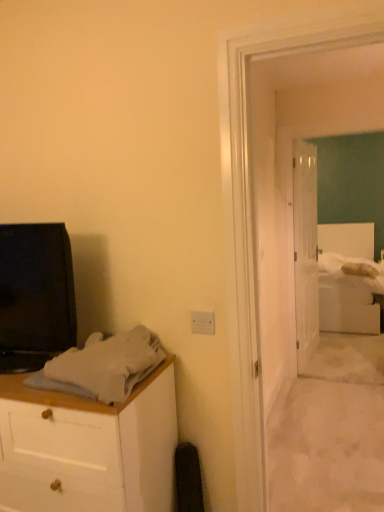
Question: Would you say black glossy tv at left is outside white soft bedsheet at center-right, placed as the second sheet when sorted from front to back?

Choices:
 (A) no
 (B) yes

Answer: (B)

Question: Considering the relative sizes of black glossy tv at left and white soft bedsheet at center-right, the first sheet when ordered from right to left, in the image provided, is black glossy tv at left bigger than white soft bedsheet at center-right, the first sheet when ordered from right to left,?

Choices:
 (A) no
 (B) yes

Answer: (B)

Question: Is black glossy tv at left far from white soft bedsheet at center-right, placed as the second sheet when sorted from front to back?

Choices:
 (A) no
 (B) yes

Answer: (B)

Question: Would you say white soft bedsheet at center-right, positioned as the 1th sheet in back-to-front order, is part of black glossy tv at left's contents?

Choices:
 (A) yes
 (B) no

Answer: (B)

Question: From the image's perspective, is black glossy tv at left above white soft bedsheet at center-right, placed as the second sheet when sorted from front to back?

Choices:
 (A) no
 (B) yes

Answer: (A)

Question: Is black glossy tv at left taller than white soft bedsheet at center-right, the second sheet from the bottom?

Choices:
 (A) yes
 (B) no

Answer: (A)

Question: Could white glossy door at center be considered to be inside gray cotton sheet at left, the second sheet from the top?

Choices:
 (A) yes
 (B) no

Answer: (B)

Question: Is gray cotton sheet at left, which ranks as the 2th sheet in right-to-left order, thinner than white glossy door at center?

Choices:
 (A) no
 (B) yes

Answer: (A)

Question: Is gray cotton sheet at left, which is the 2th sheet from back to front, not within white glossy door at center?

Choices:
 (A) no
 (B) yes

Answer: (B)

Question: Is gray cotton sheet at left, the 1th sheet in the front-to-back sequence, behind white glossy door at center?

Choices:
 (A) no
 (B) yes

Answer: (A)

Question: Does gray cotton sheet at left, marked as the first sheet in a left-to-right arrangement, turn towards white glossy door at center?

Choices:
 (A) no
 (B) yes

Answer: (A)

Question: Is gray cotton sheet at left, the first sheet in the bottom-to-top sequence, positioned before white glossy door at center?

Choices:
 (A) yes
 (B) no

Answer: (A)

Question: Is white soft bed at right next to white soft bedsheet at center-right, the 1th sheet from the top?

Choices:
 (A) no
 (B) yes

Answer: (A)